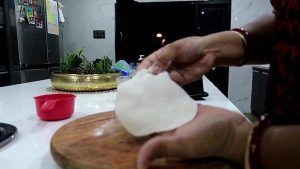
Locate an element on the screen. The image size is (300, 169). green plants on counter is located at coordinates (74, 65), (96, 66), (104, 65).